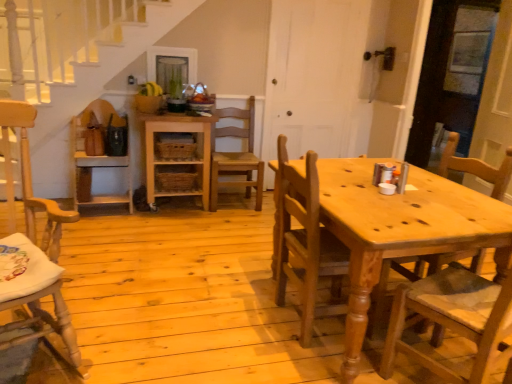
Find the location of a particular element. free space in front of wooden chair at center, arranged as the 3th chair when viewed from the left is located at coordinates (218, 224).